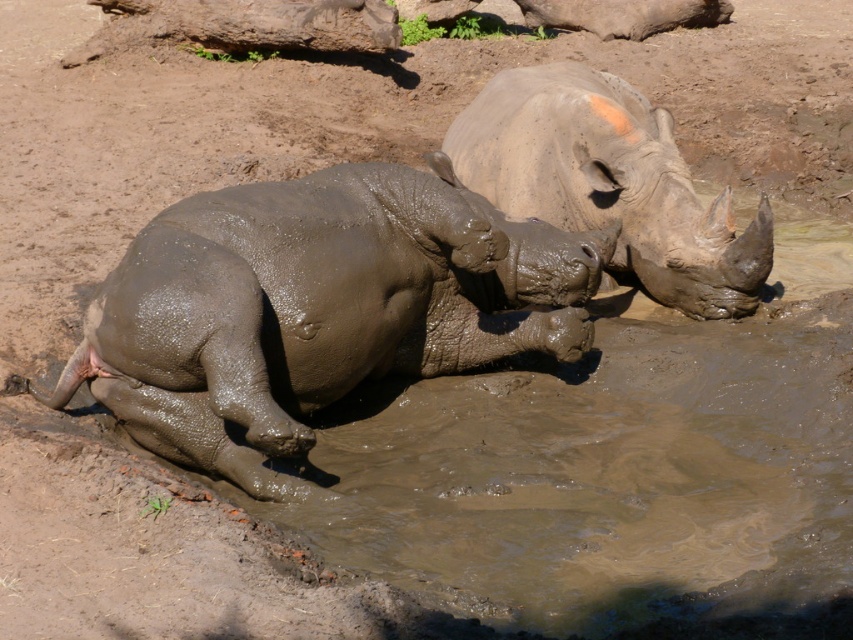
You are a zookeeper observing the rhinos in their enclosure. You notice a specific point marked at coordinates (317, 308). Which rhino is located at this point?

The muddy gray rhino at left is located at point (317, 308).

You are a zookeeper who needs to separate the two rhinos using a divider that is 1.2 meters wide. Based on the image, will the divider fit between the muddy gray rhino at left and the gray matte rhinoceros at upper right?

The distance between the muddy gray rhino at left and the gray matte rhinoceros at upper right is 1.19 meters. Since the divider is 1.2 meters wide, it is slightly wider than the space between them, so the divider will not fit between the two rhinos.